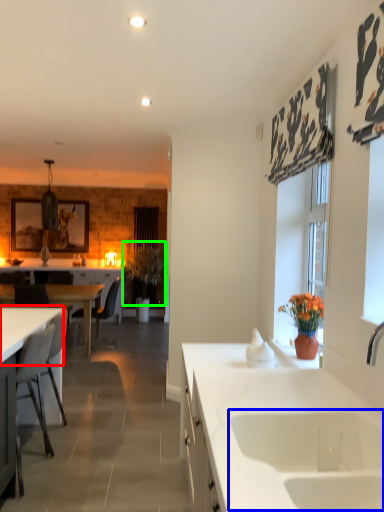
Question: Which object is positioned farthest from countertop (highlighted by a red box)? Select from sink (highlighted by a blue box) and plant (highlighted by a green box).

Choices:
 (A) sink
 (B) plant

Answer: (B)